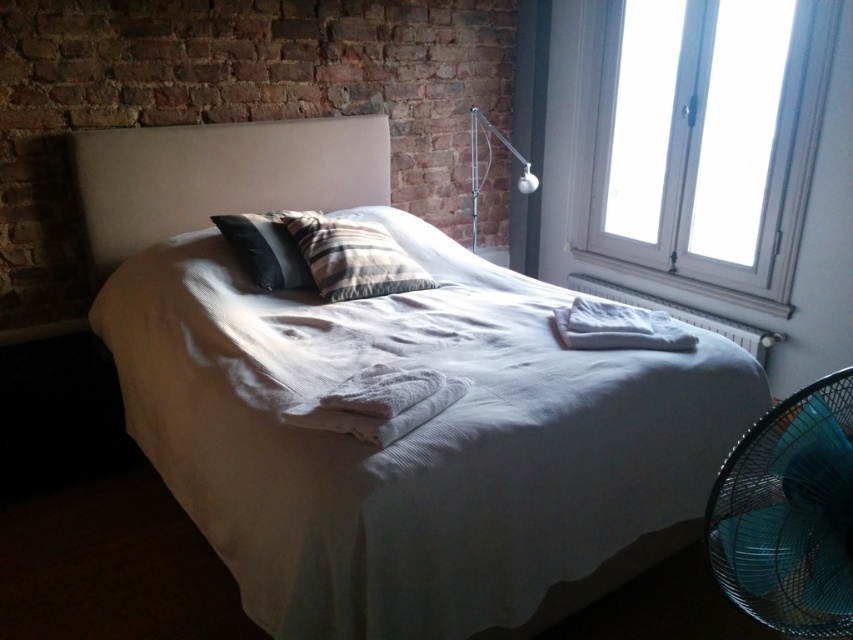
Does white textured towels at center have a lesser height compared to plaid fabric pillow at center?

Correct, white textured towels at center is not as tall as plaid fabric pillow at center.

Between point (459, 384) and point (300, 218), which one is positioned behind?

Point (300, 218)

Is point (393, 388) farther from camera compared to point (318, 262)?

No, it is not.

The image size is (853, 640). I want to click on white textured towels at center, so click(x=379, y=403).

Who is more forward, (218, 477) or (334, 232)?

Point (218, 477) is more forward.

From the picture: Which of these two, white cotton bed at center or plaid fabric pillow at center, stands taller?

white cotton bed at center is taller.

Find the location of a particular element. white cotton bed at center is located at coordinates (403, 440).

Which is in front, point (782, 582) or point (471, 173)?

Positioned in front is point (782, 582).

Which is in front, point (793, 417) or point (473, 131)?

Point (793, 417) is in front.

This screenshot has width=853, height=640. What are the coordinates of `blue metallic fan at lower right` in the screenshot? It's located at (788, 513).